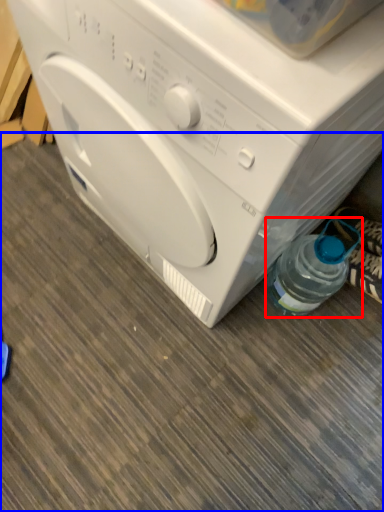
Question: Which of the following is the closest to the observer, bottle (highlighted by a red box) or surface (highlighted by a blue box)?

Choices:
 (A) bottle
 (B) surface

Answer: (B)